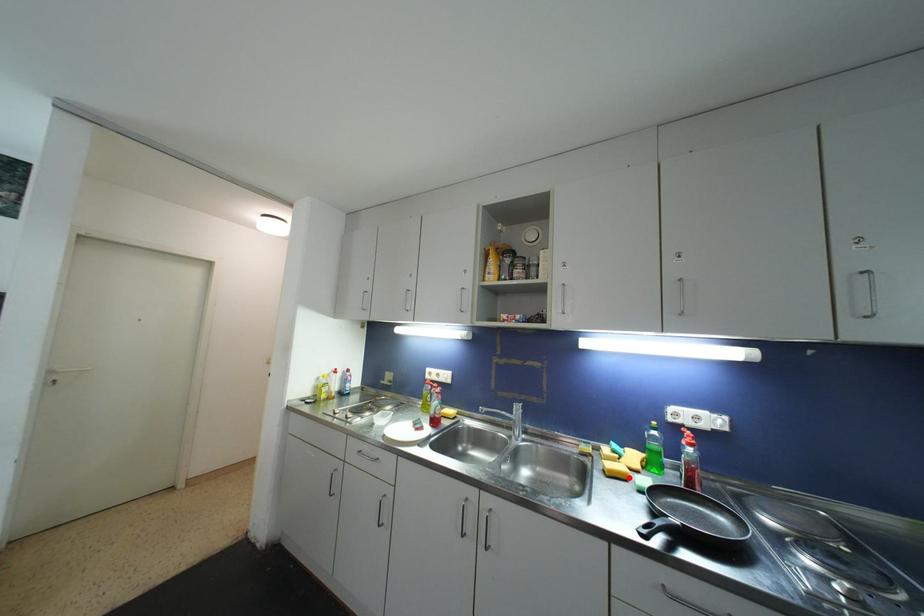
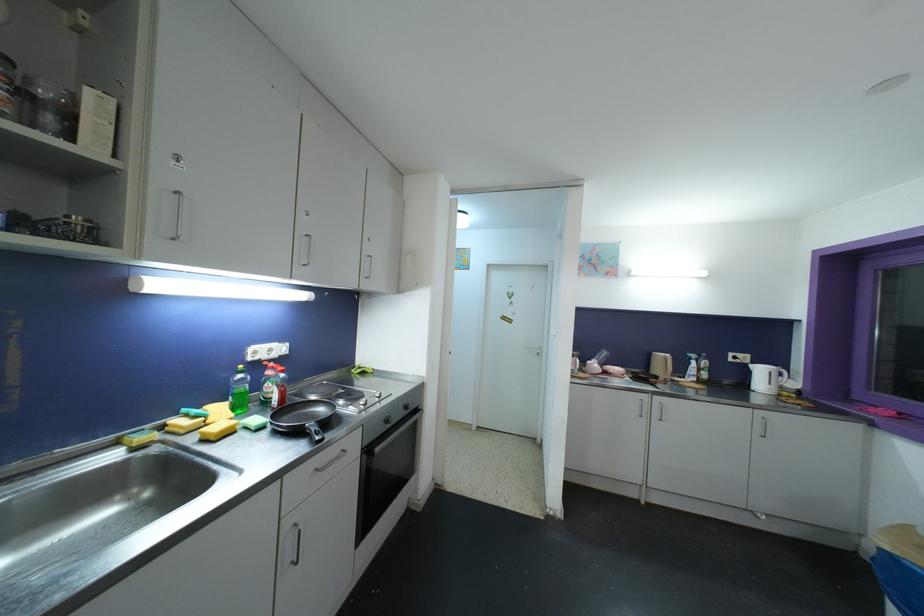
Locate, in the second image, the point that corresponds to the highlighted location in the first image.

(236, 430)